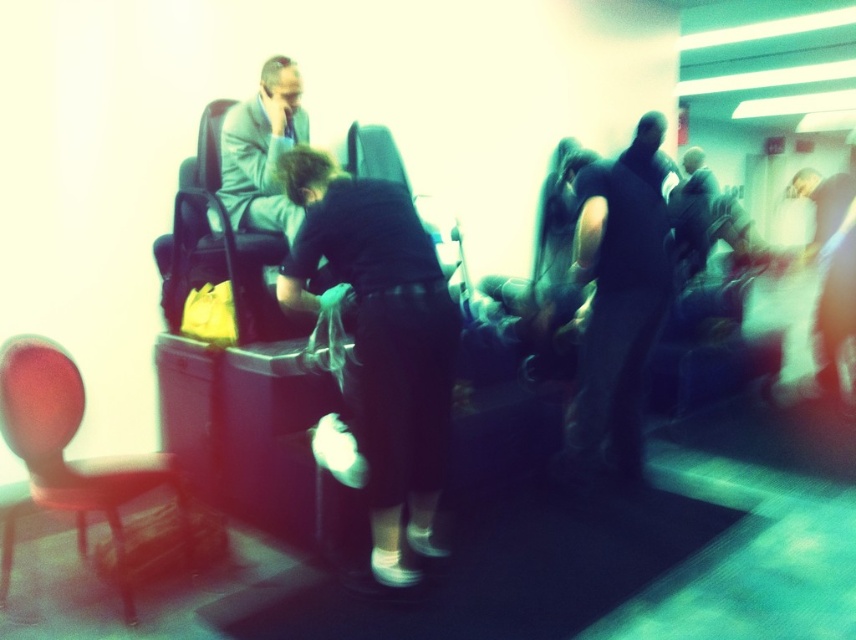
Question: Which point is closer to the camera taking this photo?

Choices:
 (A) (282, 104)
 (B) (443, 241)

Answer: (A)

Question: Does dark fabric shirt at center appear on the left side of matte red chair at left?

Choices:
 (A) yes
 (B) no

Answer: (B)

Question: Can you confirm if dark fabric shirt at center is positioned to the right of matte black chair at center?

Choices:
 (A) no
 (B) yes

Answer: (A)

Question: Which object is closer to the camera taking this photo?

Choices:
 (A) dark fabric shirt at center
 (B) matte black chair at upper left
 (C) matte red chair at left
 (D) matte black chair at center

Answer: (A)

Question: Which object is closer to the camera taking this photo?

Choices:
 (A) dark fabric shirt at center
 (B) matte black chair at upper left
 (C) light blue suit at upper left
 (D) matte red chair at left

Answer: (A)

Question: Can you confirm if light blue suit at upper left is smaller than matte black chair at center?

Choices:
 (A) no
 (B) yes

Answer: (B)